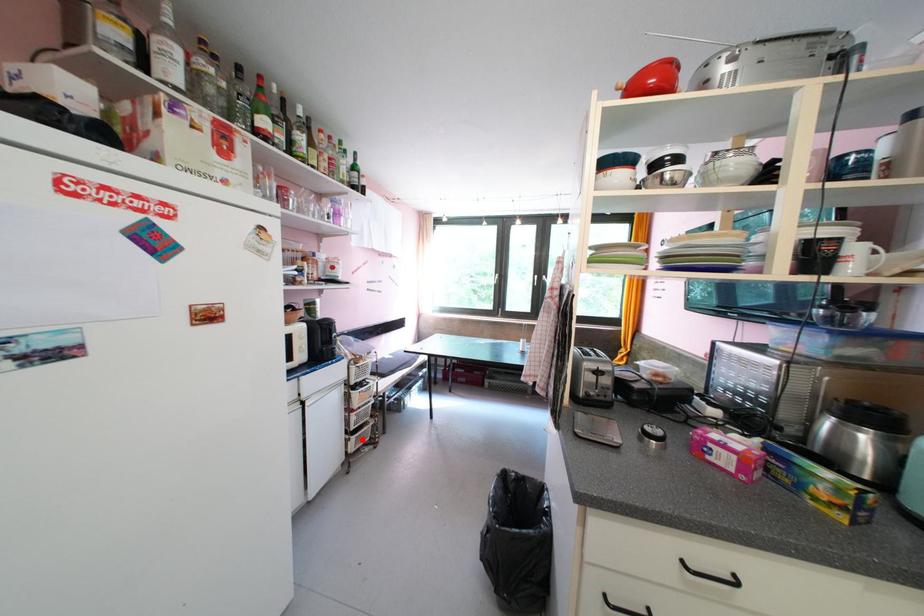
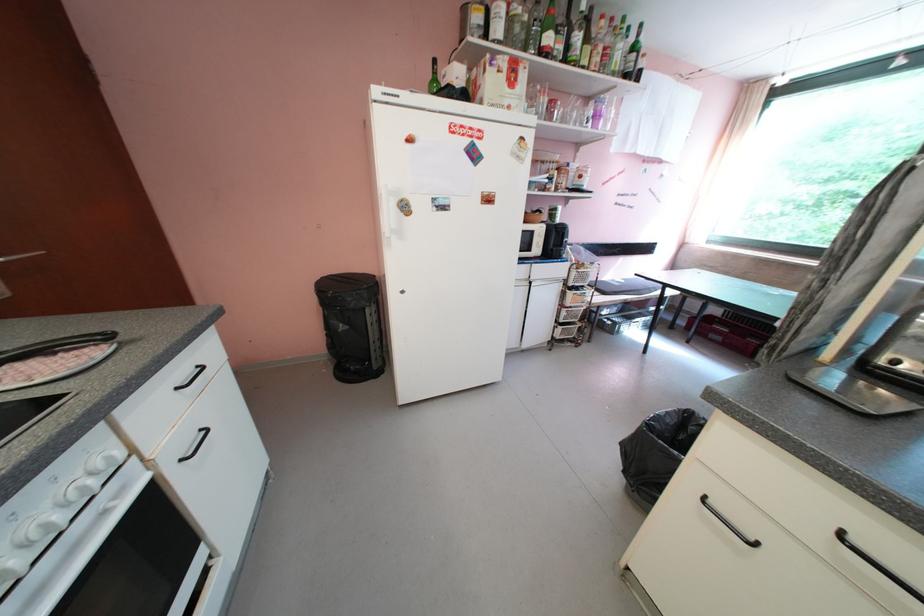
The point at the highlighted location is marked in the first image. Where is the corresponding point in the second image?

(568, 330)